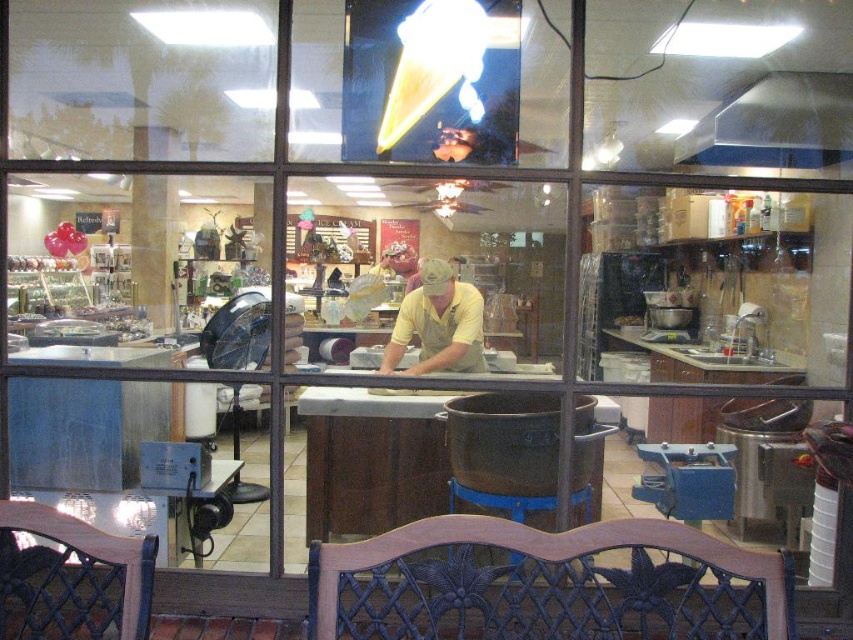
You are standing outside the bakery looking through the window. There are two points marked on the window at coordinates point (582,552) and point (456,314). Which point is closer to you?

Point (582,552) is closer to the viewer than point (456,314).

You are a customer entering the bakery and want to sit down immediately. There are two seats available, the wooden chair at lower left and the wooden stool at center. Which one is smaller and better suited for a child to use?

The wooden chair at lower left is smaller in size compared to the wooden stool at center, making it more suitable for a child to use.

You are a person who is 1.8 meters tall. You want to sit on the wooden chair with dark finish at lower center. Will your feet touch the ground when you sit?

The wooden chair with dark finish at lower center is 1.53 meters from camera. Since the distance from the camera does not indicate the chair height, we cannot determine if your feet will touch the ground based on the given information.